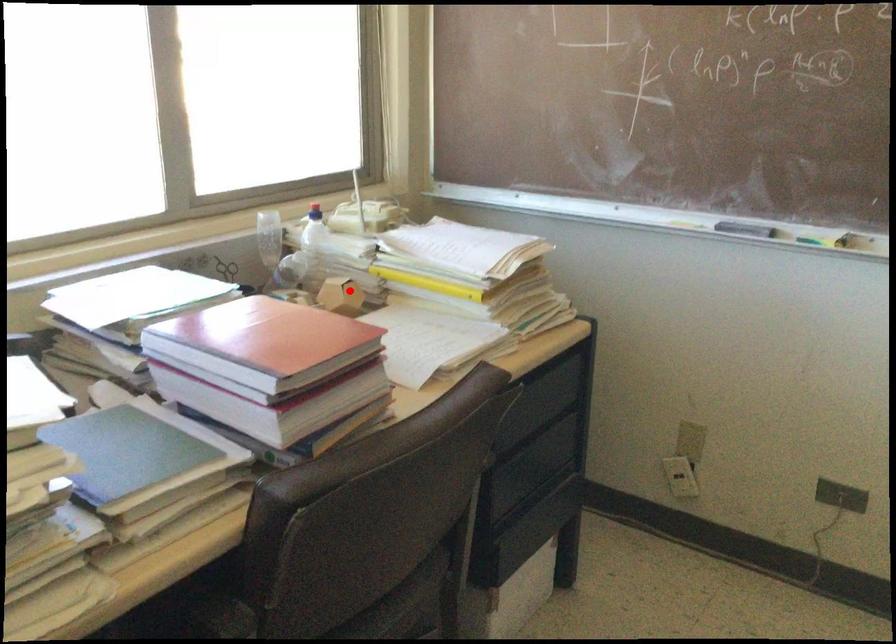
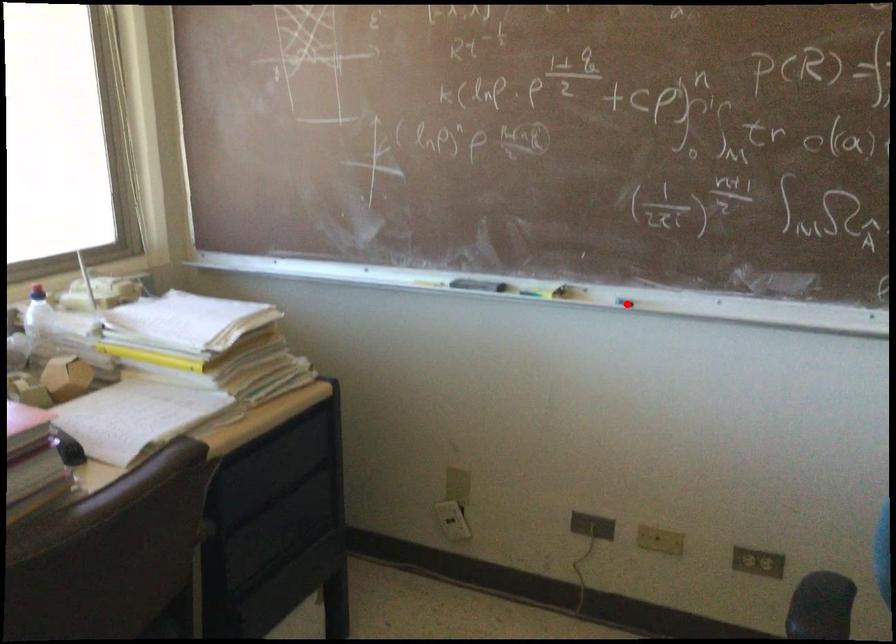
I am providing you with two images of the same scene from different viewpoints. A red point is marked on the first image and another point is marked on the second image. Are the points marked in image1 and image2 representing the same 3D position?

No